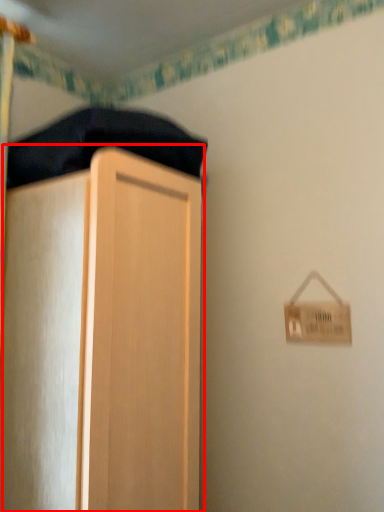
Question: Considering the relative positions of cupboard (annotated by the red box) and bedding in the image provided, where is cupboard (annotated by the red box) located with respect to the staircase?

Choices:
 (A) left
 (B) right

Answer: (A)